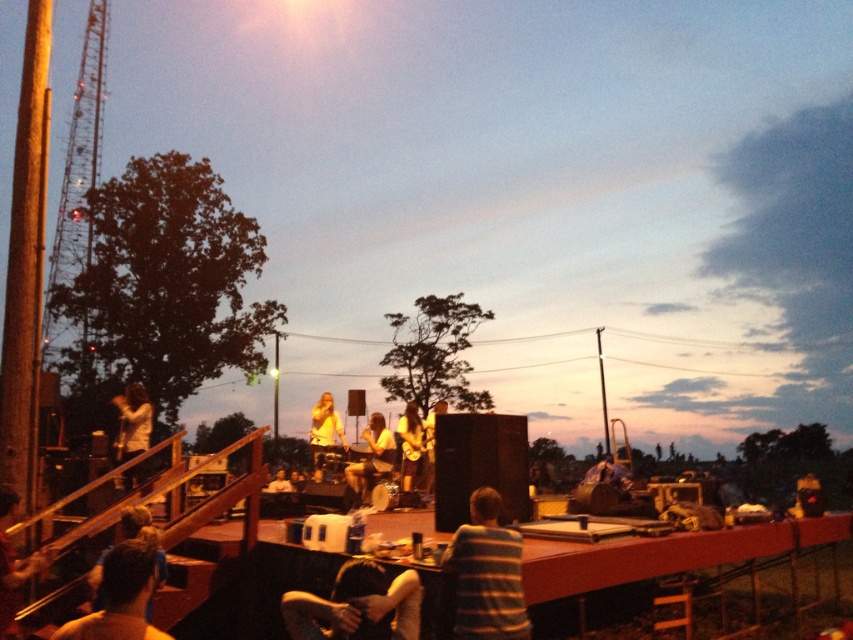
Question: Which point appears farthest from the camera in this image?

Choices:
 (A) (409, 580)
 (B) (461, 593)

Answer: (A)

Question: Which point is closer to the camera taking this photo?

Choices:
 (A) (281, 472)
 (B) (332, 621)
 (C) (317, 422)
 (D) (90, 577)

Answer: (B)

Question: Is matte black guitar at center smaller than smooth skin person at center?

Choices:
 (A) no
 (B) yes

Answer: (B)

Question: Is blue fabric shirt at lower left positioned before smooth skin person at center?

Choices:
 (A) no
 (B) yes

Answer: (B)

Question: Among these points, which one is farthest from the camera?

Choices:
 (A) (164, 573)
 (B) (433, 410)
 (C) (311, 429)
 (D) (349, 465)

Answer: (B)

Question: Can you confirm if smooth skin person at lower center is positioned to the left of shiny blonde hair at center?

Choices:
 (A) no
 (B) yes

Answer: (A)